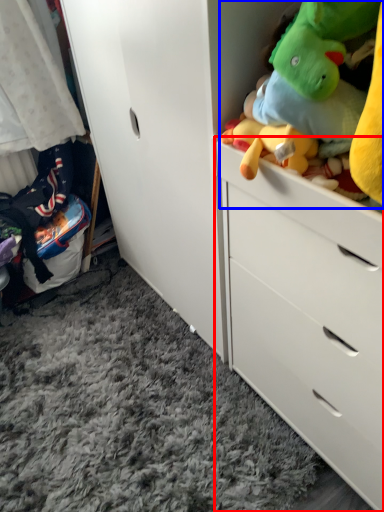
Question: Which of the following is the closest to the observer, chest of drawers (highlighted by a red box) or stuff (highlighted by a blue box)?

Choices:
 (A) chest of drawers
 (B) stuff

Answer: (B)